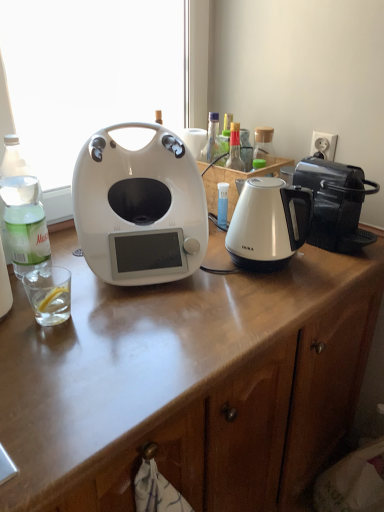
Question: Does white glossy window screen at center lie in front of clear glass at left?

Choices:
 (A) yes
 (B) no

Answer: (B)

Question: Does white glossy window screen at center contain clear glass at left?

Choices:
 (A) yes
 (B) no

Answer: (B)

Question: Is white glossy window screen at center to the left of clear glass at left from the viewer's perspective?

Choices:
 (A) no
 (B) yes

Answer: (A)

Question: Is white glossy window screen at center behind clear glass at left?

Choices:
 (A) yes
 (B) no

Answer: (A)

Question: From a real-world perspective, does white glossy window screen at center sit lower than clear glass at left?

Choices:
 (A) no
 (B) yes

Answer: (A)

Question: Can you confirm if white glossy window screen at center is wider than clear glass at left?

Choices:
 (A) no
 (B) yes

Answer: (B)

Question: Is clear glass bottle at left facing away from white plastic power outlet at upper right?

Choices:
 (A) yes
 (B) no

Answer: (B)

Question: From the image's perspective, would you say clear glass bottle at left is shown under white plastic power outlet at upper right?

Choices:
 (A) yes
 (B) no

Answer: (A)

Question: From a real-world perspective, is clear glass bottle at left physically above white plastic power outlet at upper right?

Choices:
 (A) no
 (B) yes

Answer: (A)

Question: Does clear glass bottle at left have a greater height compared to white plastic power outlet at upper right?

Choices:
 (A) no
 (B) yes

Answer: (B)

Question: Does clear glass bottle at left have a larger size compared to white plastic power outlet at upper right?

Choices:
 (A) no
 (B) yes

Answer: (B)

Question: Does clear glass bottle at left have a lesser height compared to white plastic power outlet at upper right?

Choices:
 (A) no
 (B) yes

Answer: (A)

Question: From the image's perspective, is clear glass bottle at left on top of white glossy kettle at center-right?

Choices:
 (A) no
 (B) yes

Answer: (B)